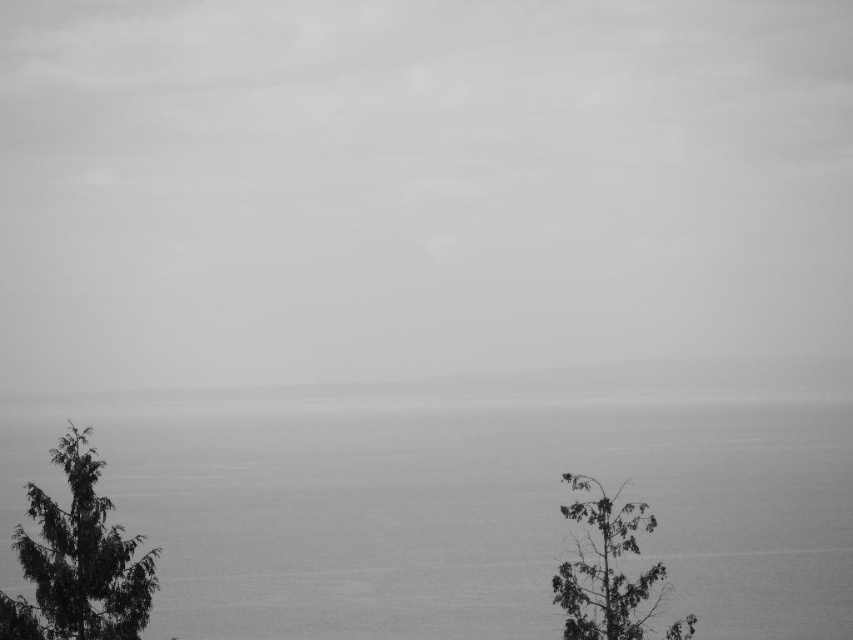
Question: Which point is farther from the camera taking this photo?

Choices:
 (A) (119, 579)
 (B) (621, 611)
 (C) (598, 396)

Answer: (C)

Question: Is gray foggy horizon at center smaller than dark green textured tree at lower left?

Choices:
 (A) yes
 (B) no

Answer: (B)

Question: Which of the following is the farthest from the observer?

Choices:
 (A) [117, 541]
 (B) [399, 387]
 (C) [595, 554]
 (D) [495, 600]

Answer: (B)

Question: Can you confirm if gray water at center is bigger than dark green textured tree at right?

Choices:
 (A) yes
 (B) no

Answer: (A)

Question: Among these points, which one is farthest from the camera?

Choices:
 (A) (64, 570)
 (B) (338, 396)
 (C) (587, 589)

Answer: (B)

Question: Observing the image, what is the correct spatial positioning of dark green textured tree at lower left in reference to dark green textured tree at right?

Choices:
 (A) above
 (B) below

Answer: (A)